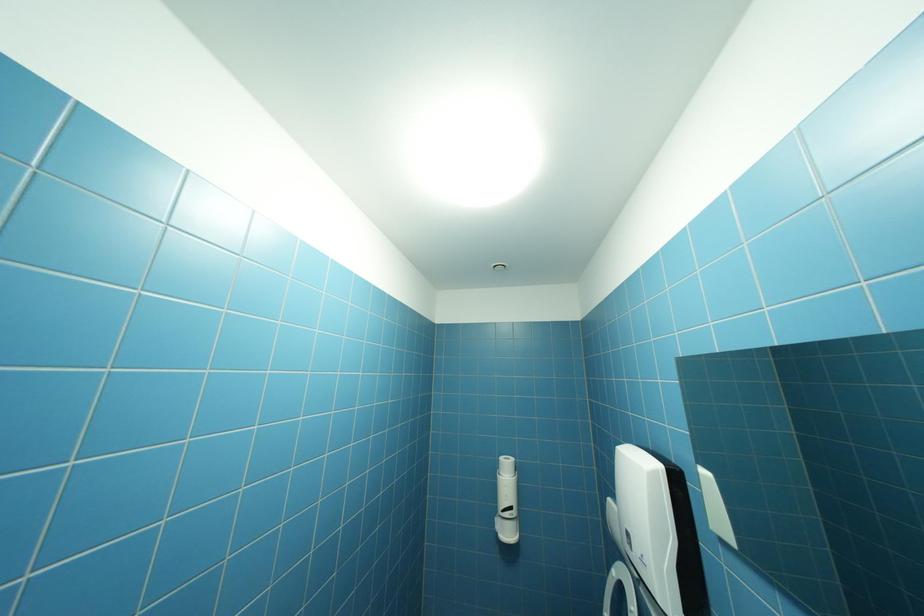
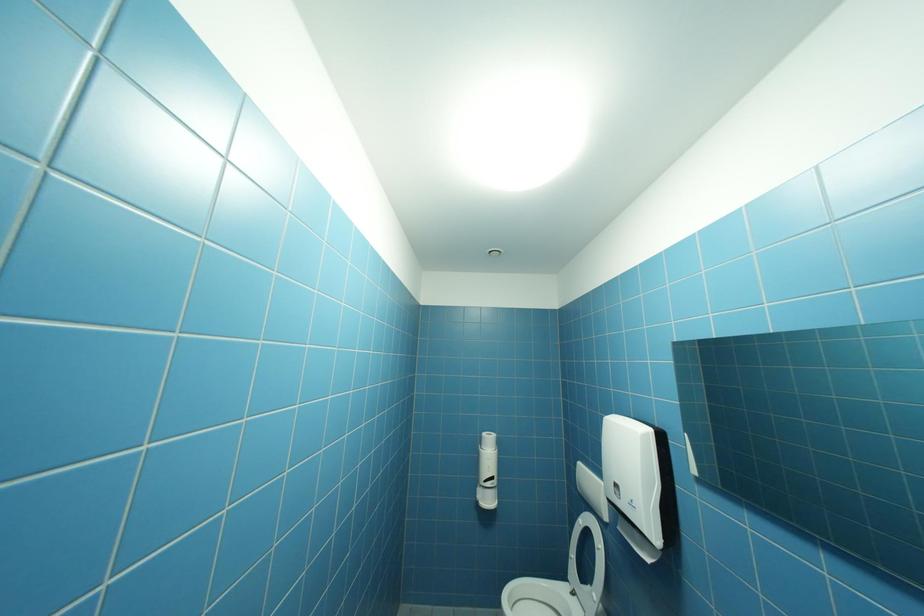
Question: What movement of the cameraman would produce the second image?

Choices:
 (A) Left
 (B) Right
 (C) Forward
 (D) Backward

Answer: (A)